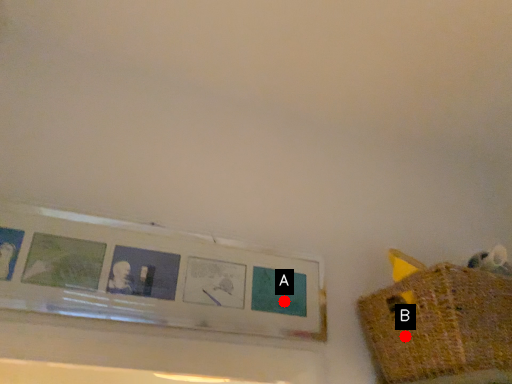
Question: Two points are circled on the image, labeled by A and B beside each circle. Which point is farther to the camera?

Choices:
 (A) A is further
 (B) B is further

Answer: (A)